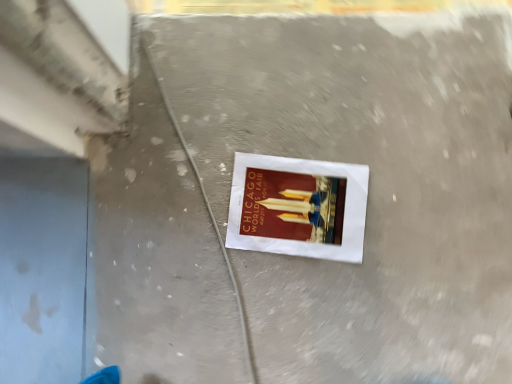
Locate an element on the screen. free spot above white paper poster at center (from a real-world perspective) is located at coordinates coord(307,207).